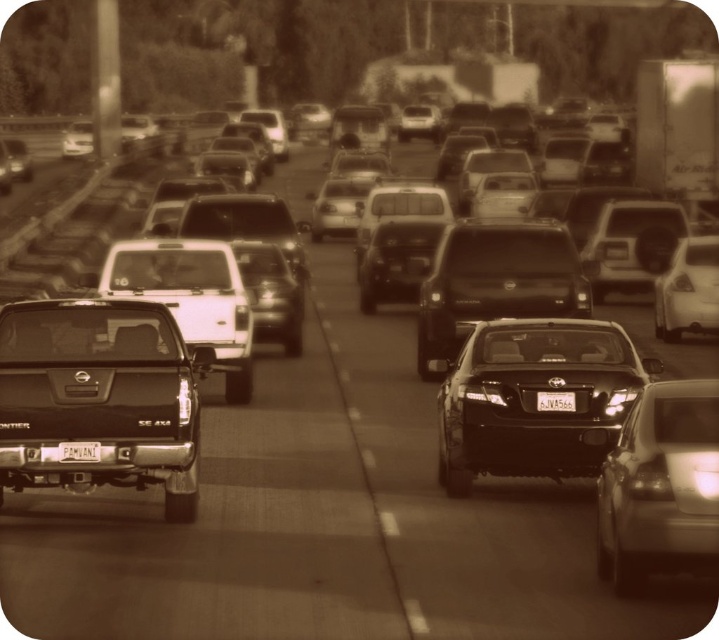
Question: Which object is farther from the camera taking this photo?

Choices:
 (A) shiny black sedan at center
 (B) matte white truck at center
 (C) matte black truck at left

Answer: (B)

Question: Considering the relative positions of matte white truck at center and white matte license plate at center in the image provided, where is matte white truck at center located with respect to white matte license plate at center?

Choices:
 (A) right
 (B) left

Answer: (A)

Question: Which object is positioned farthest from the matte black truck at left?

Choices:
 (A) shiny black sedan at center
 (B) shiny silver sedan at center
 (C) white matte license plate at center

Answer: (B)

Question: Is the position of shiny silver sedan at center more distant than that of metallic gray license plate at center?

Choices:
 (A) yes
 (B) no

Answer: (B)

Question: Is matte black truck at left further to the viewer compared to shiny silver sedan at center?

Choices:
 (A) no
 (B) yes

Answer: (B)

Question: Which of these objects is positioned farthest from the metallic gray license plate at center?

Choices:
 (A) matte black sedan at center
 (B) shiny black sedan at center
 (C) matte black truck at left
 (D) matte white truck at center

Answer: (D)